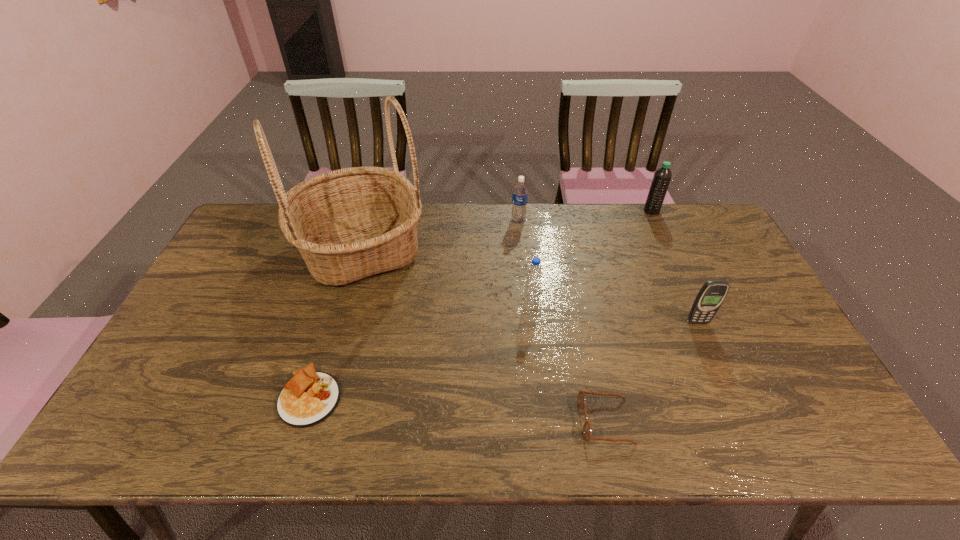
Locate an element on the screen. free location located on the left of the second farthest water bottle is located at coordinates (433, 220).

Find the location of `blank space located on the front of the nearest water bottle`. blank space located on the front of the nearest water bottle is located at coordinates (537, 346).

Identify the location of free spot located on the screen of the cellular telephone. (730, 395).

At what (x,y) coordinates should I click in order to perform the action: click on free space located 0.210m on the front-facing side of the spectacles. Please return your answer as a coordinate pair (x, y). Looking at the image, I should click on (491, 421).

Where is `vacant region located on the front-facing side of the spectacles`? vacant region located on the front-facing side of the spectacles is located at coordinates (512, 421).

At what (x,y) coordinates should I click in order to perform the action: click on vacant space positioned 0.400m on the front-facing side of the spectacles. Please return your answer as a coordinate pair (x, y). This screenshot has height=540, width=960. Looking at the image, I should click on point(409,421).

What are the coordinates of `vacant space located on the back of the omelet` in the screenshot? It's located at (349, 268).

I want to click on basket present at the far edge, so click(348, 224).

Where is `spectacles that is at the near edge`? The width and height of the screenshot is (960, 540). spectacles that is at the near edge is located at coordinates (581, 399).

The image size is (960, 540). I want to click on omelet present at the near edge, so click(x=310, y=397).